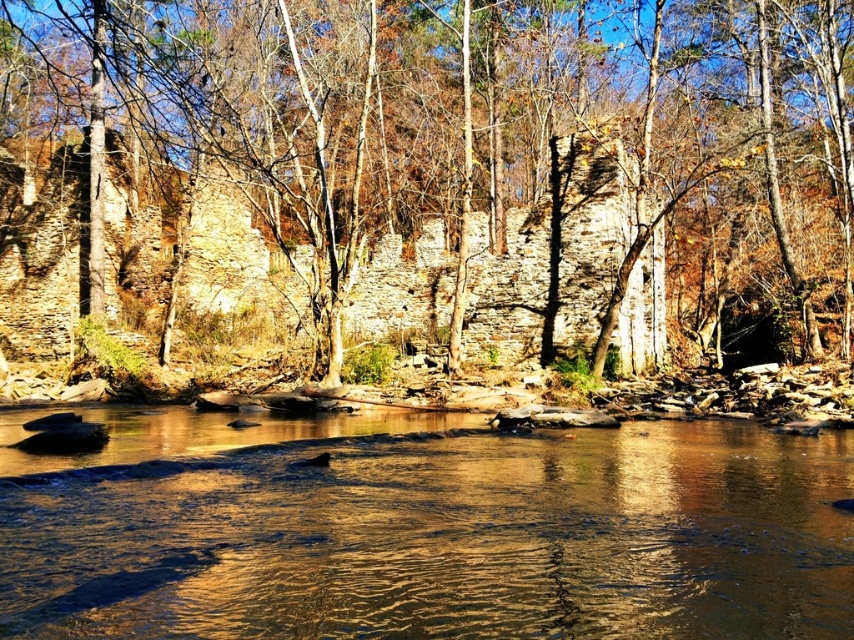
You are standing at the edge of the river and want to walk from point A to point B. Point A is located at coordinate point (x=759, y=168) and point B is at coordinate point (x=683, y=496). Which point is closer to you as you start walking?

Point A at coordinate point (x=759, y=168) is closer to you because it is further to the viewer than point B at coordinate point (x=683, y=496).

You are standing at the edge of the river and notice two elements at the center of the image. Which one is larger between the smooth bark tree at center and the golden reflective water at center?

The smooth bark tree at center is bigger than the golden reflective water at center.

You are standing at the riverside and see the smooth bark tree at center and the golden reflective water at center. Which object is positioned more to the left?

The smooth bark tree at center is positioned more to the left than the golden reflective water at center.